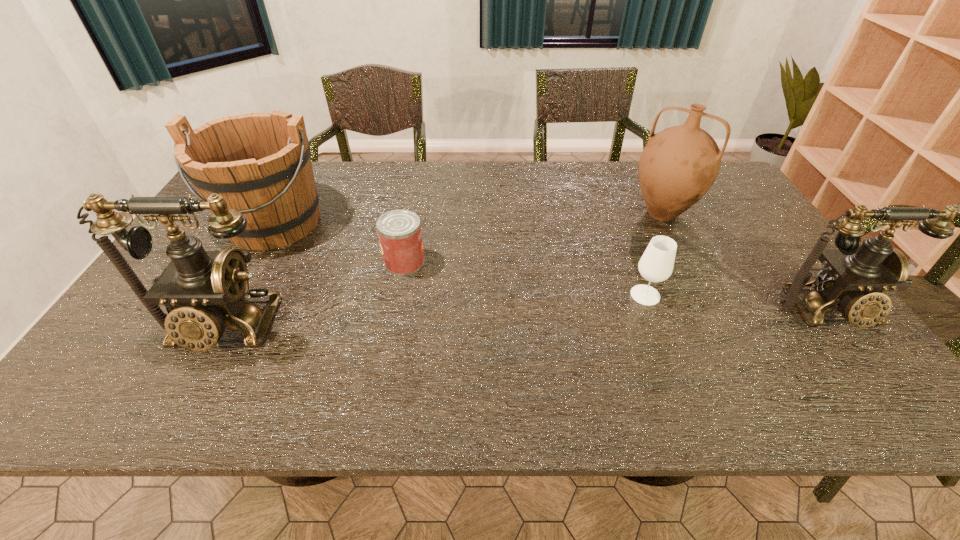
To make them evenly spaced by inserting another telephone among them, please locate a free space for this new telephone. Please provide its 2D coordinates. Your answer should be formatted as a tuple, i.e. [(x, y)], where the tuple contains the x and y coordinates of a point satisfying the conditions above.

[(531, 320)]